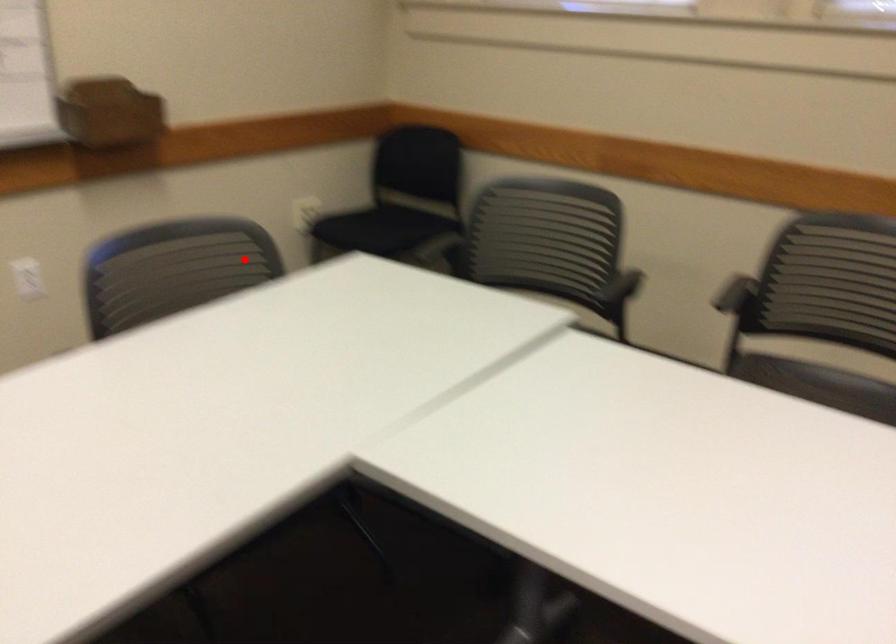
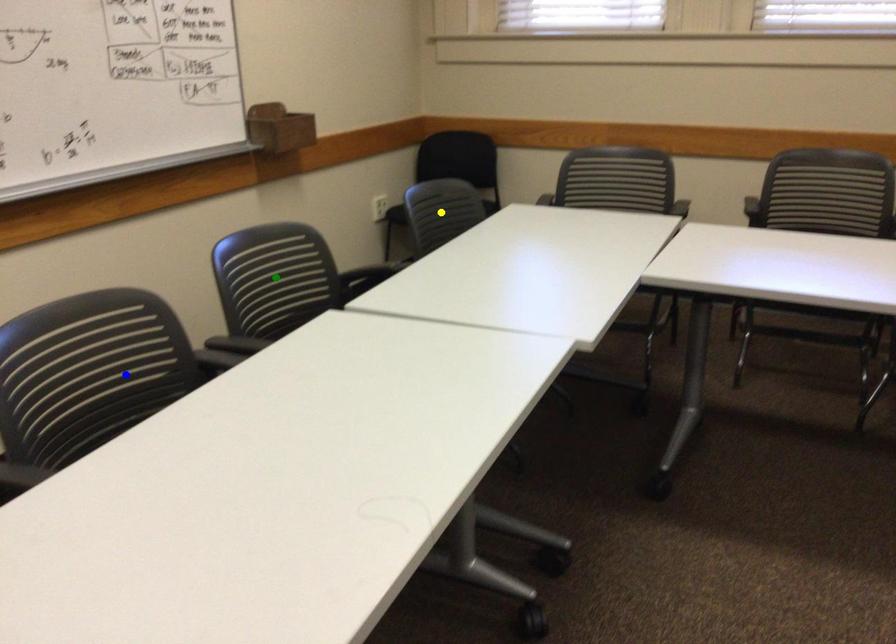
Question: I am providing you with two images of the same scene from different viewpoints. A red point is marked on the first image. You are given multiple points on the second image. Which spot in image 2 lines up with the point in image 1?

Choices:
 (A) yellow point
 (B) blue point
 (C) green point

Answer: (A)